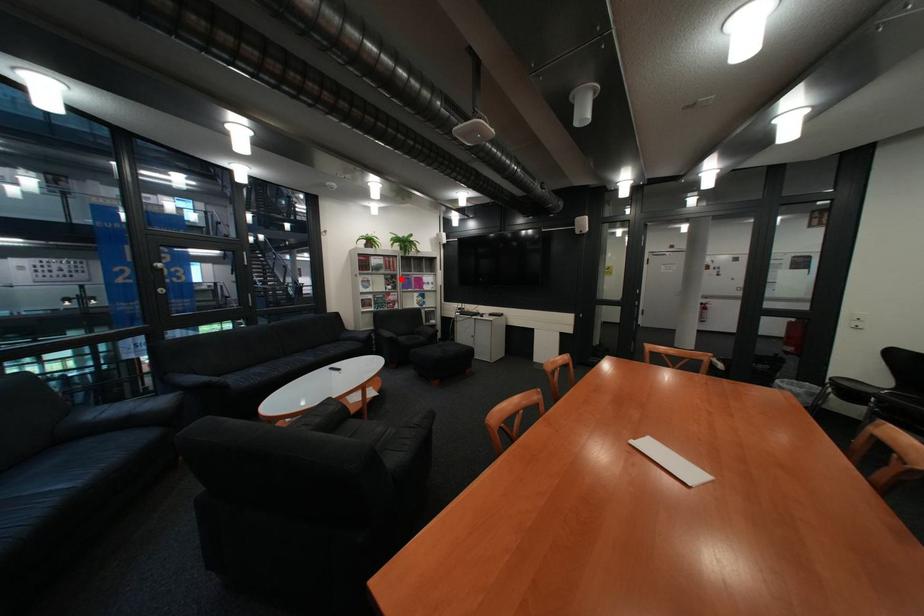
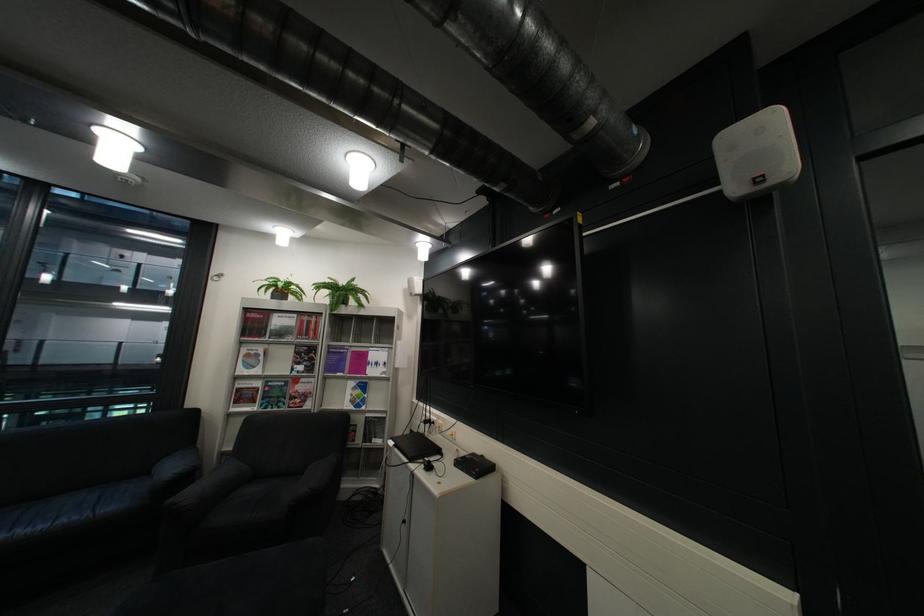
Question: A red point is marked in image1. In image2, is the corresponding 3D point closer to the camera or farther? Reply with the corresponding letter.

Choices:
 (A) The corresponding 3D point is closer.
 (B) The corresponding 3D point is farther.

Answer: (B)